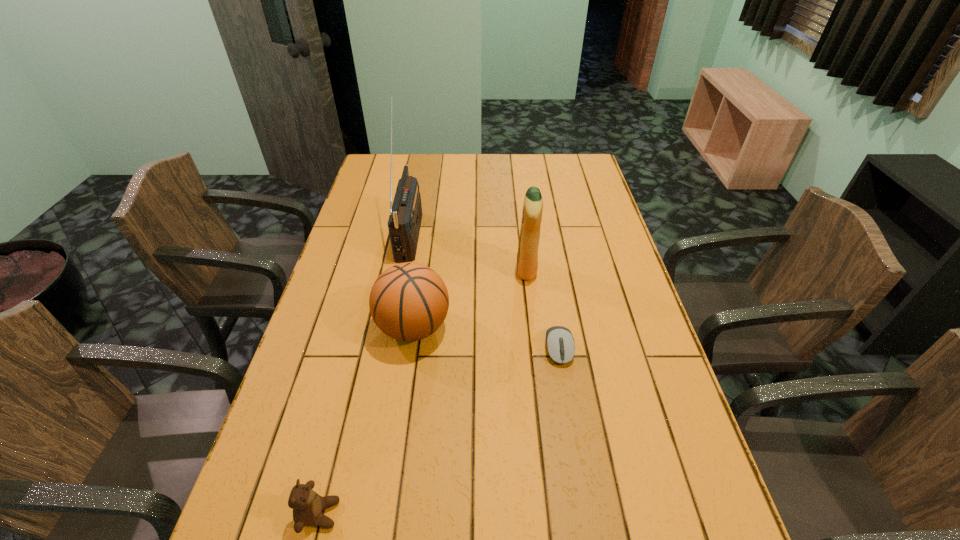
Where is `free point at the far edge`? free point at the far edge is located at coordinates (535, 166).

What are the coordinates of `free location at the left edge of the desktop` in the screenshot? It's located at (345, 339).

Locate an element on the screen. Image resolution: width=960 pixels, height=540 pixels. vacant space at the right edge of the desktop is located at coordinates (597, 196).

The image size is (960, 540). Identify the location of vacant space at the far left corner of the desktop. (397, 178).

This screenshot has height=540, width=960. I want to click on free space between the radio receiver and the shortest object, so (485, 291).

Find the location of a particular element. The image size is (960, 540). empty location between the computer equipment and the fourth shortest object is located at coordinates (542, 309).

Image resolution: width=960 pixels, height=540 pixels. I want to click on vacant area between the computer equipment and the fourth shortest object, so tap(542, 309).

This screenshot has width=960, height=540. In order to click on free space between the computer equipment and the detergent in this screenshot , I will do `click(542, 309)`.

You are a GUI agent. You are given a task and a screenshot of the screen. Output one action in this format:
    pyautogui.click(x=<x>, y=<y>)
    Task: Click on the free spot between the fourth shortest object and the computer equipment
    
    Given the screenshot: What is the action you would take?
    pyautogui.click(x=542, y=309)

Find the location of a particular element. free space between the detergent and the third tallest object is located at coordinates (470, 298).